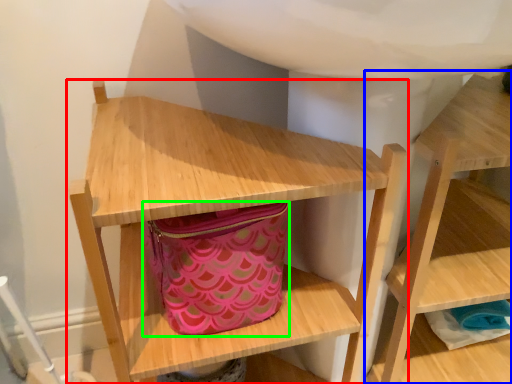
Question: Considering the real-world distances, which object is farthest from shelf (highlighted by a red box)? shelf (highlighted by a blue box) or bag (highlighted by a green box)?

Choices:
 (A) shelf
 (B) bag

Answer: (A)